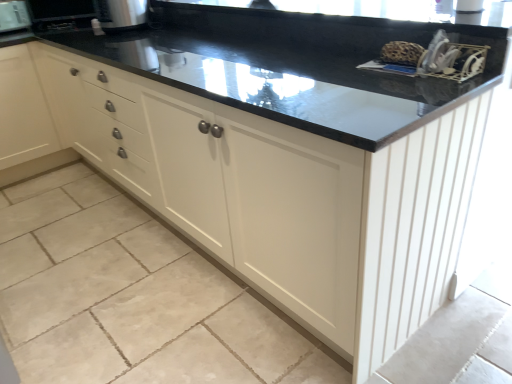
Question: Is satin silver toaster at upper left, the second appliance from the back, in front of brushed metal toaster at upper left, the 2th appliance when ordered from right to left?

Choices:
 (A) no
 (B) yes

Answer: (B)

Question: Is satin silver toaster at upper left, marked as the first appliance in a front-to-back arrangement, smaller than brushed metal toaster at upper left, the 1th appliance positioned from the back?

Choices:
 (A) no
 (B) yes

Answer: (A)

Question: Is satin silver toaster at upper left, marked as the first appliance in a front-to-back arrangement, to the right of brushed metal toaster at upper left, the 2th appliance when ordered from right to left, from the viewer's perspective?

Choices:
 (A) yes
 (B) no

Answer: (A)

Question: Considering the relative positions of satin silver toaster at upper left, the second appliance from the back, and brushed metal toaster at upper left, the 2th appliance when ordered from right to left, in the image provided, is satin silver toaster at upper left, the second appliance from the back, to the left of brushed metal toaster at upper left, the 2th appliance when ordered from right to left, from the viewer's perspective?

Choices:
 (A) yes
 (B) no

Answer: (B)

Question: Considering the relative sizes of satin silver toaster at upper left, the second appliance from the back, and brushed metal toaster at upper left, the 1th appliance positioned from the back, in the image provided, is satin silver toaster at upper left, the second appliance from the back, wider than brushed metal toaster at upper left, the 1th appliance positioned from the back,?

Choices:
 (A) yes
 (B) no

Answer: (A)

Question: Is satin silver toaster at upper left, marked as the first appliance in a front-to-back arrangement, facing towards brushed metal toaster at upper left, the 2th appliance when ordered from right to left?

Choices:
 (A) no
 (B) yes

Answer: (A)

Question: Is brushed metal toaster at upper left, which appears as the second appliance when viewed from the front, facing towards satin silver toaster at upper left, which is the 2th appliance from left to right?

Choices:
 (A) no
 (B) yes

Answer: (B)

Question: Would you say brushed metal toaster at upper left, the 1th appliance positioned from the back, is outside satin silver toaster at upper left, marked as the first appliance in a front-to-back arrangement?

Choices:
 (A) yes
 (B) no

Answer: (A)

Question: Is brushed metal toaster at upper left, the 2th appliance when ordered from right to left, taller than satin silver toaster at upper left, which is the 2th appliance from left to right?

Choices:
 (A) no
 (B) yes

Answer: (B)

Question: From a real-world perspective, is brushed metal toaster at upper left, acting as the 1th appliance starting from the left, on top of satin silver toaster at upper left, arranged as the 1th appliance when viewed from the right?

Choices:
 (A) no
 (B) yes

Answer: (A)

Question: Is brushed metal toaster at upper left, acting as the 1th appliance starting from the left, thinner than satin silver toaster at upper left, marked as the first appliance in a front-to-back arrangement?

Choices:
 (A) no
 (B) yes

Answer: (B)

Question: Is brushed metal toaster at upper left, the 2th appliance when ordered from right to left, at the right side of satin silver toaster at upper left, which is the 2th appliance from left to right?

Choices:
 (A) no
 (B) yes

Answer: (A)

Question: In terms of height, does brushed metal toaster at upper left, the 2th appliance when ordered from right to left, look taller or shorter compared to satin silver toaster at upper left, the second appliance from the back?

Choices:
 (A) tall
 (B) short

Answer: (A)